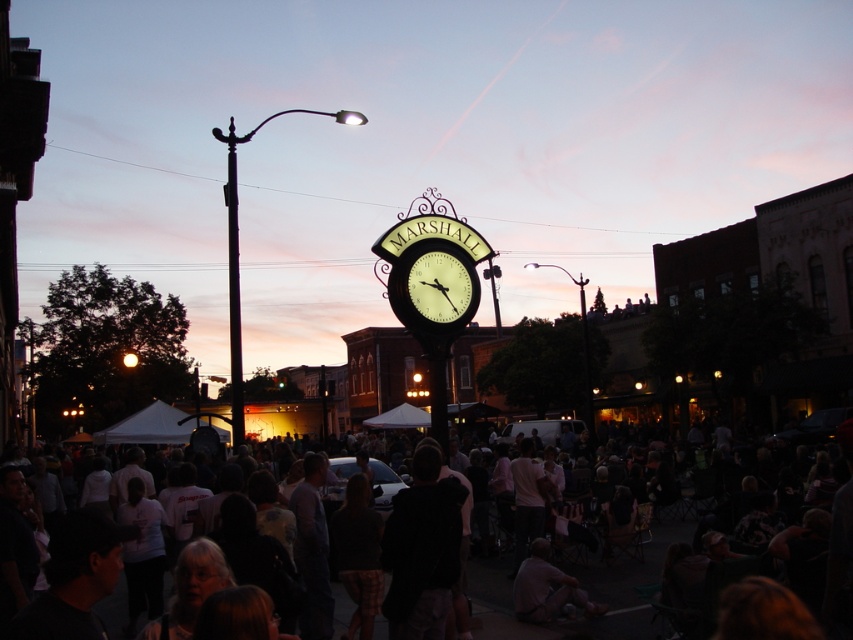
Question: Estimate the real-world distances between objects in this image. Which object is closer to the metallic pole at center-left?

Choices:
 (A) dark clothing crowd at center
 (B) matte black clock at center

Answer: (B)

Question: Is metallic pole at center-left closer to the viewer compared to matte black clock at center?

Choices:
 (A) no
 (B) yes

Answer: (B)

Question: Which point appears closest to the camera in this image?

Choices:
 (A) (242, 413)
 (B) (473, 577)

Answer: (B)

Question: Among these objects, which one is farthest from the camera?

Choices:
 (A) matte black clock at center
 (B) metallic pole at center-left

Answer: (A)

Question: Does dark clothing crowd at center have a lesser width compared to metallic pole at center-left?

Choices:
 (A) yes
 (B) no

Answer: (B)

Question: Does metallic pole at center-left appear under matte black clock at center?

Choices:
 (A) no
 (B) yes

Answer: (A)